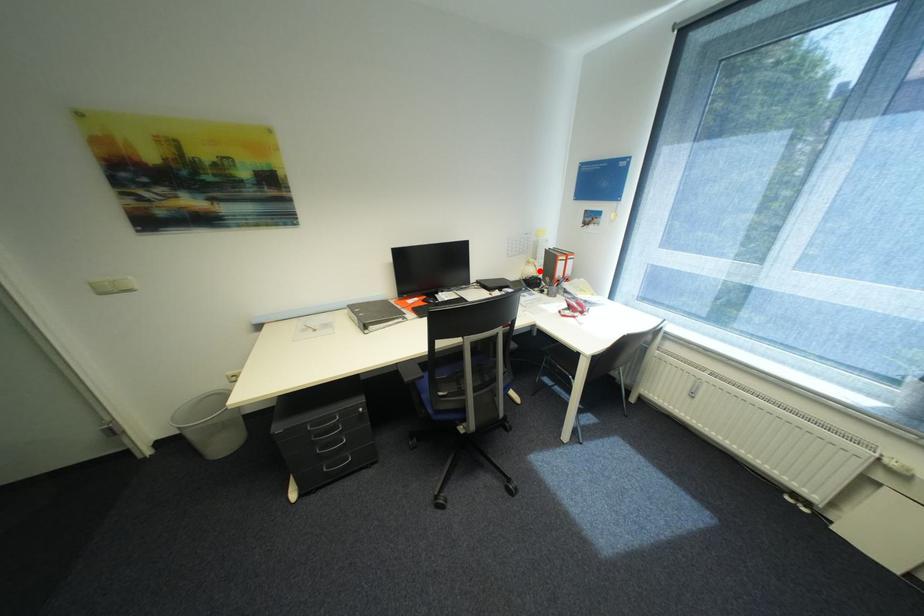
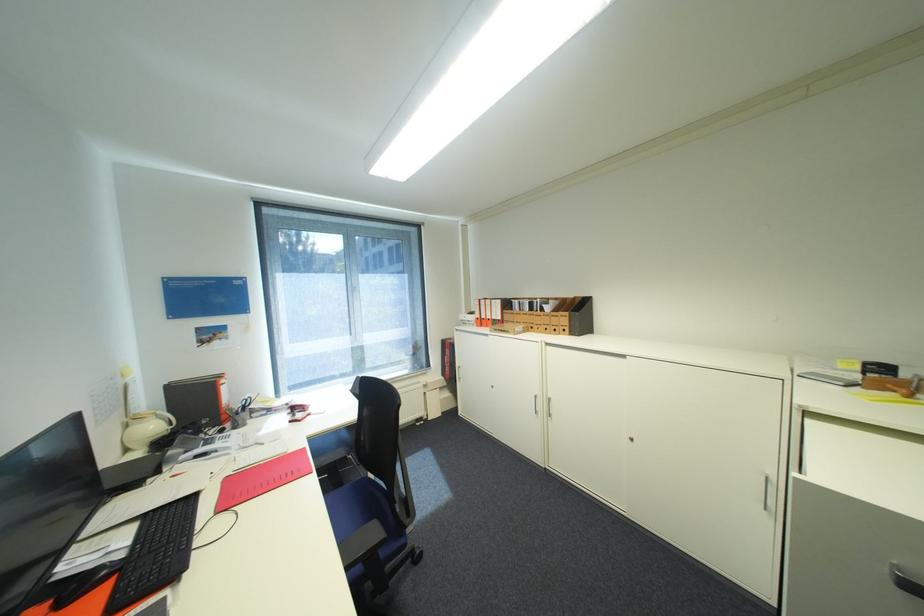
The point at the highlighted location is marked in the first image. Where is the corresponding point in the second image?

(161, 427)